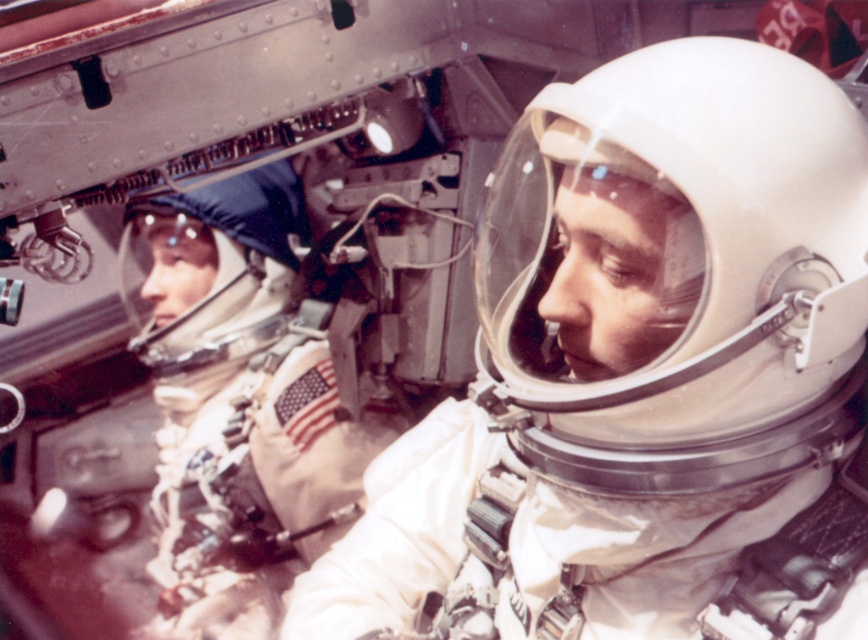
You are an astronaut in the spacecraft. You need to determine which object is larger between the white matte spacesuit at center and the white matte helmet at left. Which one is bigger?

The white matte spacesuit at center is bigger than the white matte helmet at left.

You are an astronaut inside a spacecraft. You need to locate the white matte helmet at center. According to the coordinates provided, where would you find it?

The white matte helmet at center is located at coordinates point (686, 269).

You are an astronaut inside the spacecraft and need to reach the control panel located behind the white matte helmet at center and the white matte helmet at left. Which helmet do you need to move out of the way first?

The white matte helmet at center is in front of the white matte helmet at left, so you need to move the white matte helmet at center first to access the control panel behind them.